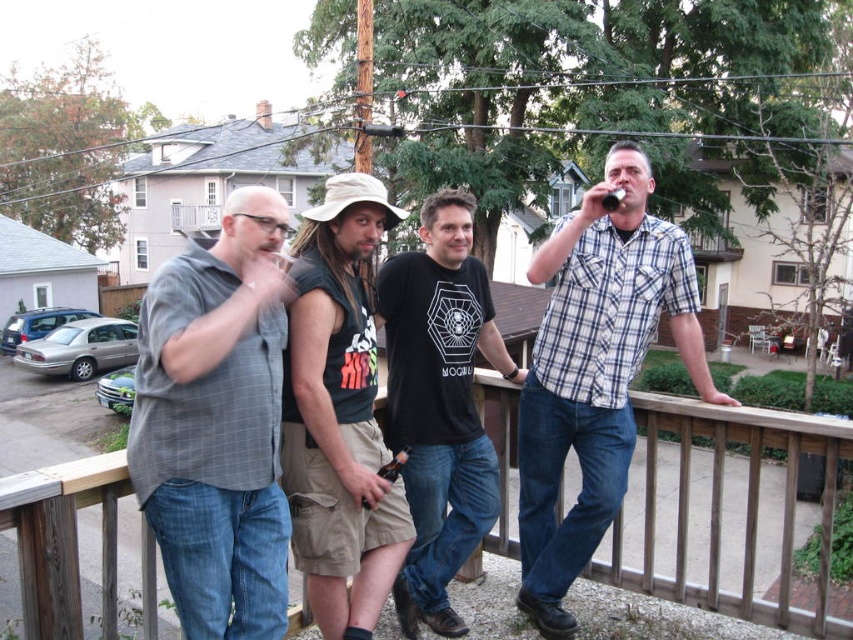
You are a photographer trying to capture a group photo of the plaid cotton shirt at right and the khaki cotton shorts at center. Since you want to ensure both subjects are in focus, you need to know which one is taller. Can you determine which one is taller?

The plaid cotton shirt at right is taller than the khaki cotton shorts at center, so you should adjust your camera settings to focus on the taller subject first.

You are a photographer trying to capture the group of people on the deck. You want to ensure that the gray checkered shirt at left is centered in your photo. Based on the coordinates provided, where should you position the camera to achieve this?

The gray checkered shirt at left is located at coordinates point (218, 422), so to center it, the camera should be positioned to focus on that exact point.